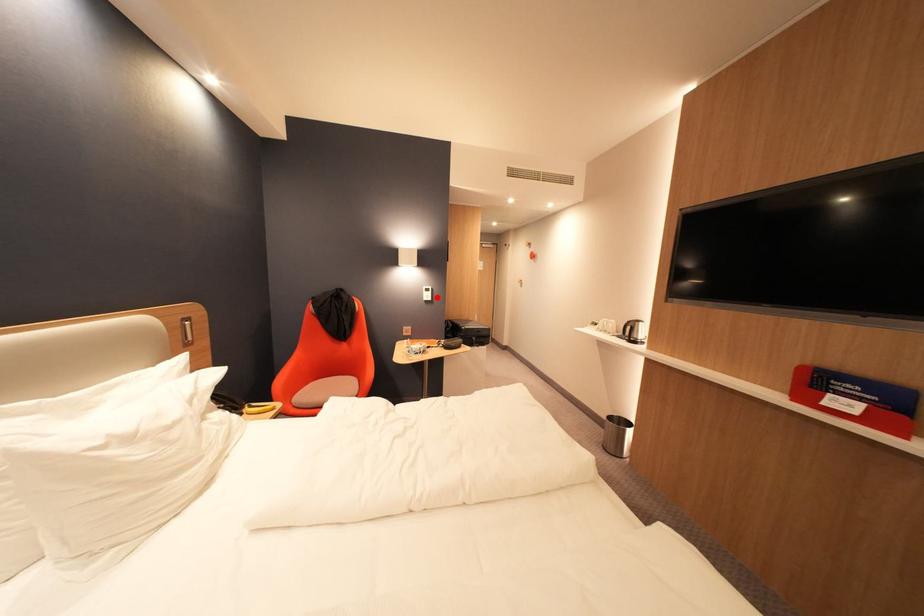
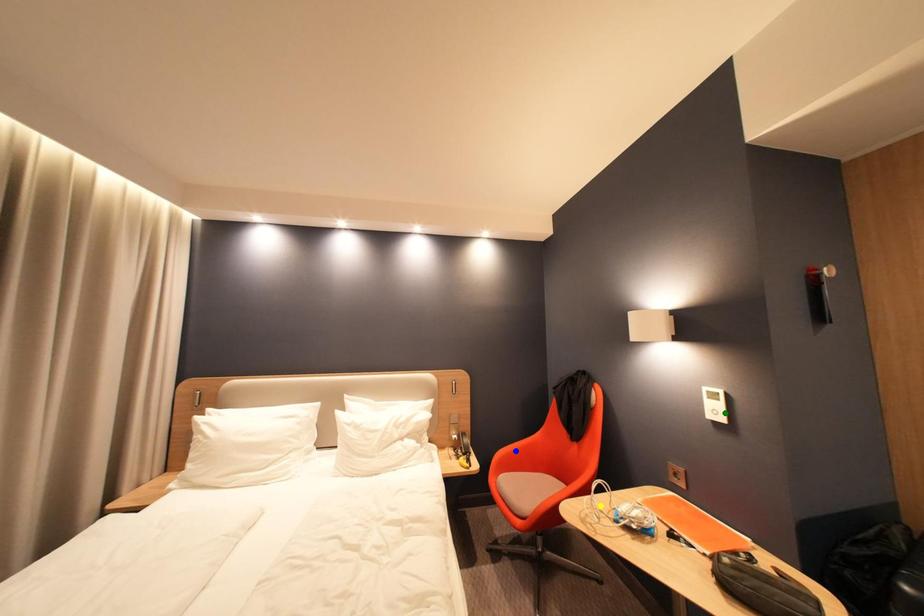
Question: I am providing you with two images of the same scene from different viewpoints. A red point is marked on the first image. You are given multiple points on the second image. Which point in image 2 represents the same 3d spot as the red point in image 1?

Choices:
 (A) yellow point
 (B) green point
 (C) blue point

Answer: (B)